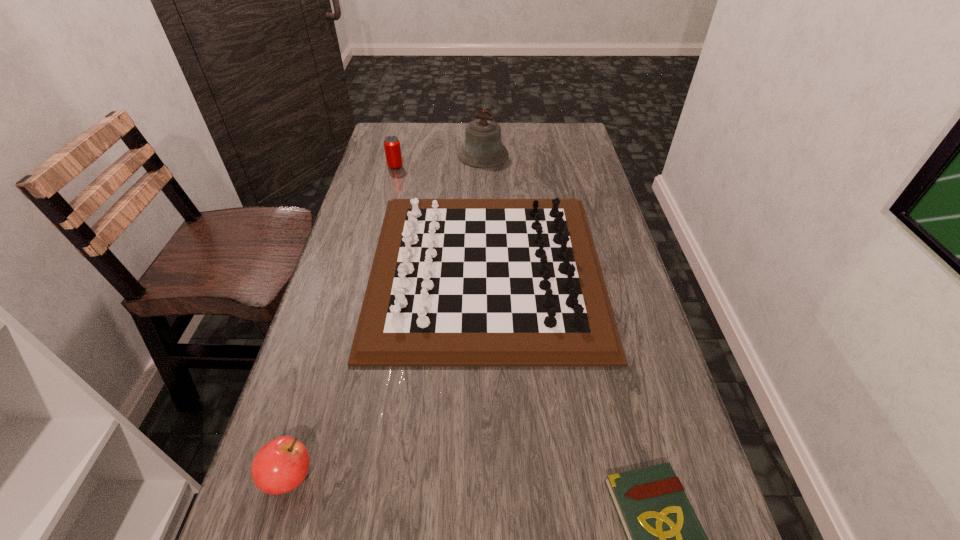
Find the location of a particular element. The width and height of the screenshot is (960, 540). the tallest object is located at coordinates (483, 148).

Find the location of a particular element. The height and width of the screenshot is (540, 960). gameboard is located at coordinates (454, 282).

At what (x,y) coordinates should I click in order to perform the action: click on can. Please return your answer as a coordinate pair (x, y). The width and height of the screenshot is (960, 540). Looking at the image, I should click on (392, 147).

Image resolution: width=960 pixels, height=540 pixels. I want to click on apple, so click(x=281, y=465).

Find the location of `vacant region located on the left of the tallest object`. vacant region located on the left of the tallest object is located at coordinates (431, 155).

The height and width of the screenshot is (540, 960). Find the location of `free region located 0.150m on the back of the gameboard`. free region located 0.150m on the back of the gameboard is located at coordinates (485, 176).

You are a GUI agent. You are given a task and a screenshot of the screen. Output one action in this format:
    pyautogui.click(x=<x>, y=<y>)
    Task: Click on the vacant space situated on the right of the can
    
    Given the screenshot: What is the action you would take?
    pyautogui.click(x=483, y=167)

Find the location of a particular element. This screenshot has height=540, width=960. vacant space located on the back of the apple is located at coordinates (333, 329).

Find the location of a particular element. The height and width of the screenshot is (540, 960). object located in the far edge section of the desktop is located at coordinates click(x=483, y=148).

Image resolution: width=960 pixels, height=540 pixels. Find the location of `gameboard located in the left edge section of the desktop`. gameboard located in the left edge section of the desktop is located at coordinates (454, 282).